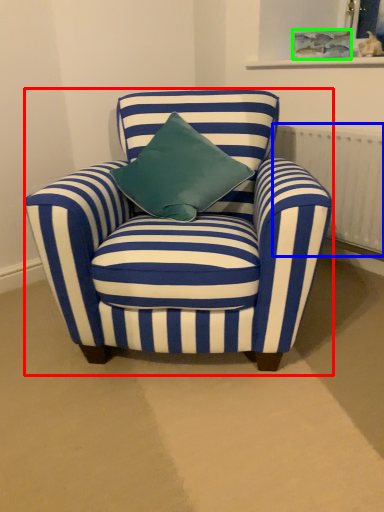
Question: Estimate the real-world distances between objects in this image. Which object is closer to chair (highlighted by a red box), radiator (highlighted by a blue box) or picture frame (highlighted by a green box)?

Choices:
 (A) radiator
 (B) picture frame

Answer: (A)